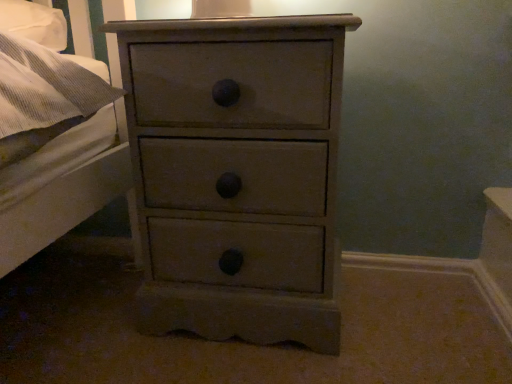
What is the approximate width of matte gray chest of drawers at center?

matte gray chest of drawers at center is 15.84 inches wide.

Describe the element at coordinates (236, 174) in the screenshot. This screenshot has height=384, width=512. I see `matte gray chest of drawers at center` at that location.

Locate an element on the screen. matte gray chest of drawers at center is located at coordinates (236, 174).

You are a GUI agent. You are given a task and a screenshot of the screen. Output one action in this format:
    pyautogui.click(x=<x>, y=<y>)
    Task: Click on the matte gray chest of drawers at center
    The image size is (512, 384).
    Given the screenshot: What is the action you would take?
    pyautogui.click(x=236, y=174)